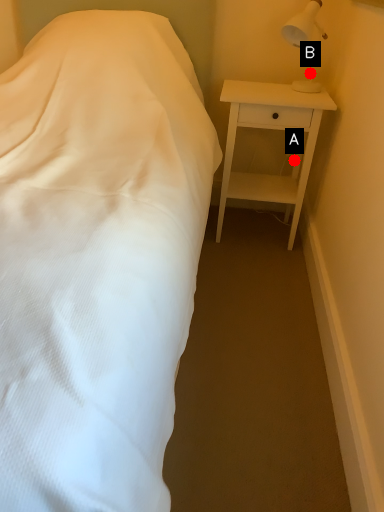
Question: Two points are circled on the image, labeled by A and B beside each circle. Which point is closer to the camera?

Choices:
 (A) A is closer
 (B) B is closer

Answer: (B)